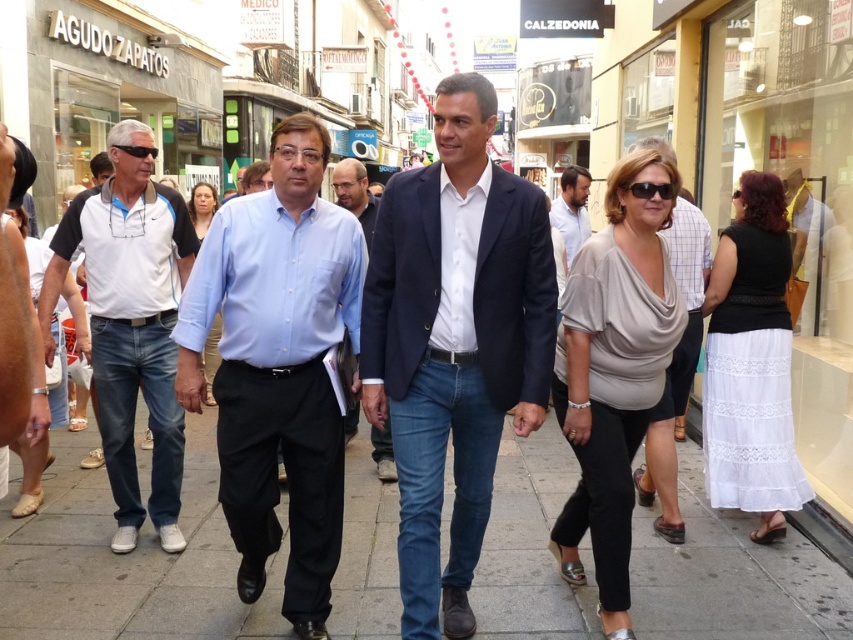
Question: Which object is the farthest from the blue shirt at center?

Choices:
 (A) smooth concrete pavement at center
 (B) matte gray blouse at center
 (C) light blue button-down shirt at center
 (D) matte blue shirt at center

Answer: (D)

Question: Does navy blue suit at center have a smaller size compared to white lace skirt at right?

Choices:
 (A) yes
 (B) no

Answer: (B)

Question: Does denim jeans at left appear on the right side of white lace skirt at right?

Choices:
 (A) yes
 (B) no

Answer: (B)

Question: Can you confirm if smooth concrete pavement at center is positioned to the right of matte blue shirt at center?

Choices:
 (A) no
 (B) yes

Answer: (A)

Question: Which of these objects is positioned closest to the black plastic sunglasses at center?

Choices:
 (A) matte gray blouse at center
 (B) black plastic sunglasses at left
 (C) denim jeans at left

Answer: (A)

Question: Which of the following is the farthest from the observer?

Choices:
 (A) matte gray blouse at center
 (B) matte blue shirt at center

Answer: (B)